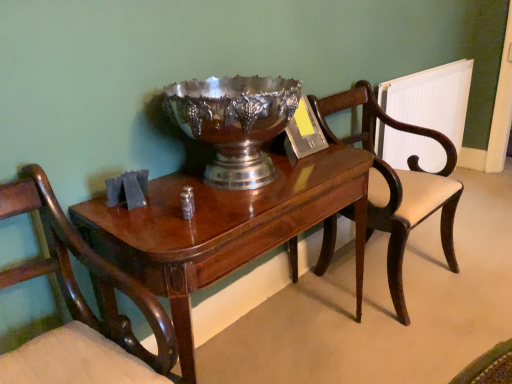
The width and height of the screenshot is (512, 384). I want to click on vacant region below mahogany wood table at center (from a real-world perspective), so click(x=272, y=341).